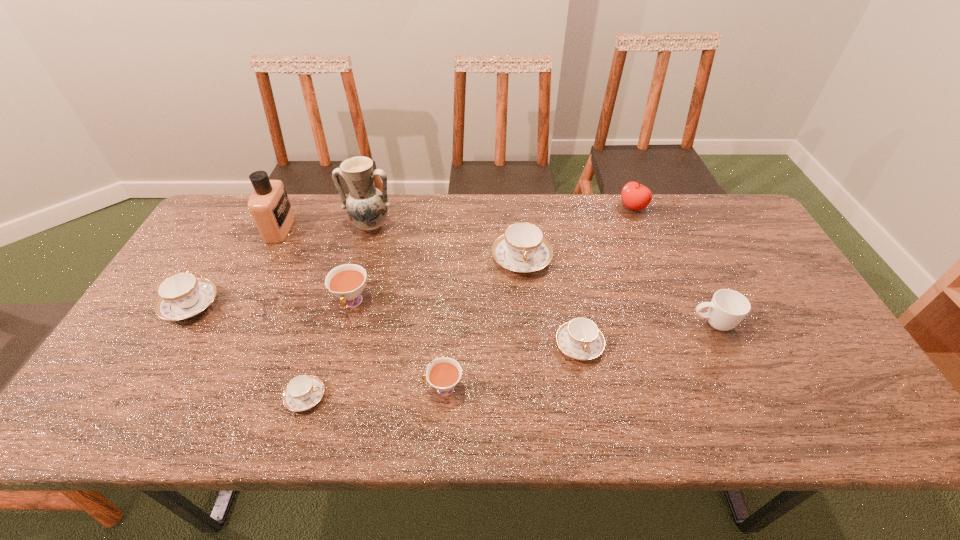
Where is `vacant area situated 0.050m on the side of the bigger white teacup with the handle`? Image resolution: width=960 pixels, height=540 pixels. vacant area situated 0.050m on the side of the bigger white teacup with the handle is located at coordinates (344, 336).

Image resolution: width=960 pixels, height=540 pixels. Identify the location of vacant space located 0.360m with the handle on the side of the cup. (551, 323).

This screenshot has height=540, width=960. I want to click on free region located 0.240m with the handle on the side of the cup, so click(597, 323).

Locate an element on the screen. vacant space located with the handle on the side of the cup is located at coordinates (670, 323).

Where is `free region located on the side with the handle of the leftmost blue teacup`? The height and width of the screenshot is (540, 960). free region located on the side with the handle of the leftmost blue teacup is located at coordinates (252, 203).

The width and height of the screenshot is (960, 540). I want to click on vacant space located 0.390m on the side with the handle of the leftmost blue teacup, so click(252, 201).

Where is `free location located on the side with the handle of the leftmost blue teacup`? The image size is (960, 540). free location located on the side with the handle of the leftmost blue teacup is located at coordinates (225, 248).

The height and width of the screenshot is (540, 960). I want to click on free spot located on the side of the smaller white teacup with the handle, so click(x=346, y=388).

The width and height of the screenshot is (960, 540). Find the location of `free space located 0.120m on the side of the smaller white teacup with the handle`. free space located 0.120m on the side of the smaller white teacup with the handle is located at coordinates (372, 388).

You are a GUI agent. You are given a task and a screenshot of the screen. Output one action in this format:
    pyautogui.click(x=<x>, y=<y>)
    Task: Click on the free region located on the side of the smaller white teacup with the handle
    
    Given the screenshot: What is the action you would take?
    pyautogui.click(x=254, y=388)